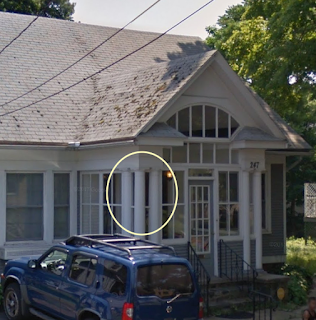
Find the location of `wrought iron railing on each side of the stairs`. wrought iron railing on each side of the stairs is located at coordinates (207, 280), (242, 276).